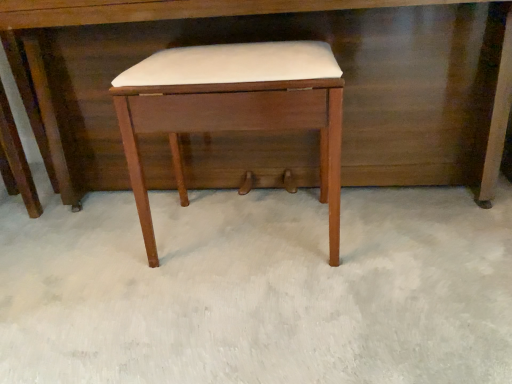
Where is `vacant region below white leather stool at center (from a real-world perspective)`? vacant region below white leather stool at center (from a real-world perspective) is located at coordinates (234, 243).